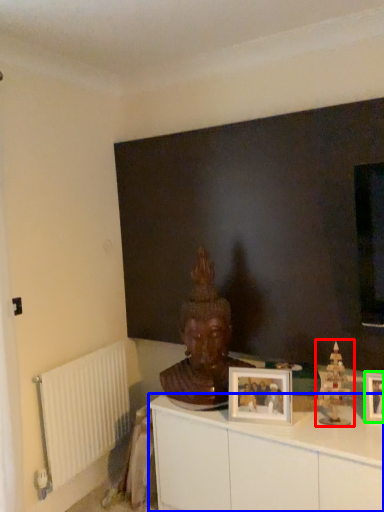
Question: Estimate the real-world distances between objects in this image. Which object is farther from toy (highlighted by a red box), cabinetry (highlighted by a blue box) or picture frame (highlighted by a green box)?

Choices:
 (A) cabinetry
 (B) picture frame

Answer: (A)